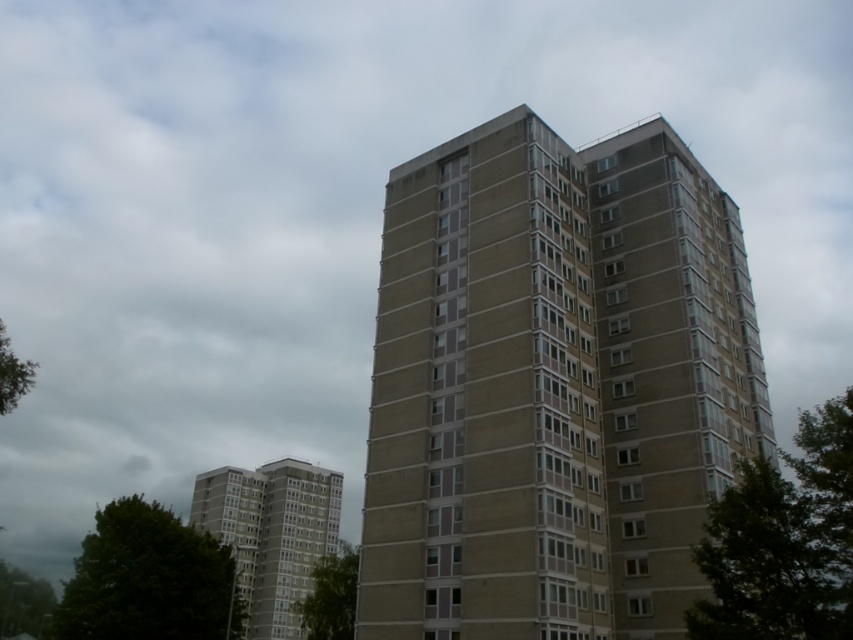
You are standing in front of the tall residential highrise and want to take a photo of the green leafy tree at right and the concrete building at lower left. Which object will appear larger in your photo?

The green leafy tree at right will appear larger in the photo because it is closer to the viewer than the concrete building at lower left.

You are standing in a park and see the concrete tower block at center and the green leafy tree at right. Which object is closer to your left side?

The concrete tower block at center is positioned on the left side of green leafy tree at right, so it is closer to your left side.